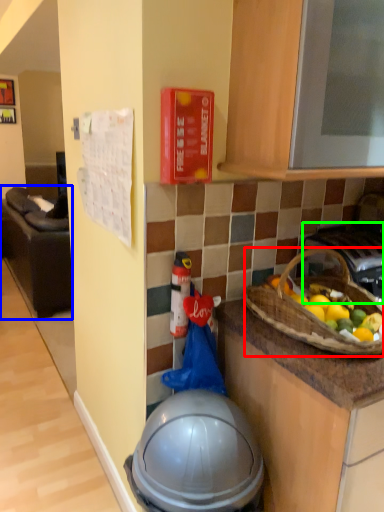
Question: Based on their relative distances, which object is nearer to picnic basket (highlighted by a red box)? Choose from furniture (highlighted by a blue box) and gas stove (highlighted by a green box).

Choices:
 (A) furniture
 (B) gas stove

Answer: (B)